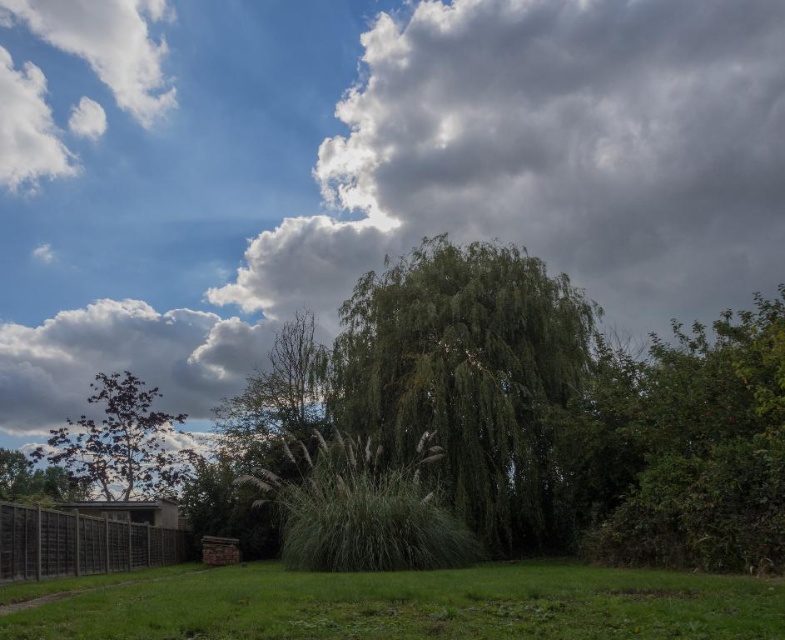
Which is more to the right, dark green leafy tree at left or green leafy tree at lower left?

Positioned to the right is dark green leafy tree at left.

Can you confirm if dark green leafy tree at left is smaller than green leafy tree at lower left?

Correct, dark green leafy tree at left occupies less space than green leafy tree at lower left.

Who is more forward, (x=174, y=426) or (x=17, y=486)?

Point (x=174, y=426)

Where is `dark green leafy tree at left`? The height and width of the screenshot is (640, 785). dark green leafy tree at left is located at coordinates (121, 442).

Does cloudy sky at upper center have a greater width compared to wooden fence at lower left?

Yes.

Which is in front, point (342, 220) or point (46, 525)?

Point (46, 525) is more forward.

Image resolution: width=785 pixels, height=640 pixels. I want to click on cloudy sky at upper center, so click(360, 170).

Does green leafy willow at center appear on the left side of green grassy at lower center?

No, green leafy willow at center is not to the left of green grassy at lower center.

Between green leafy willow at center and green grassy at lower center, which one has less height?

green grassy at lower center

From the picture: Who is more distant from viewer, (550, 346) or (754, 602)?

Point (550, 346)

Where is `green leafy willow at center`? Image resolution: width=785 pixels, height=640 pixels. green leafy willow at center is located at coordinates (468, 381).